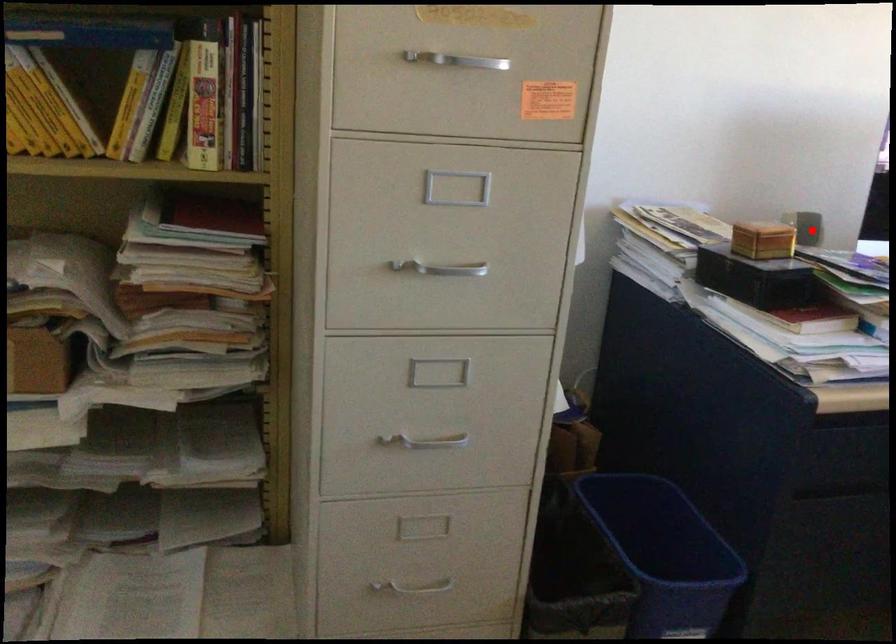
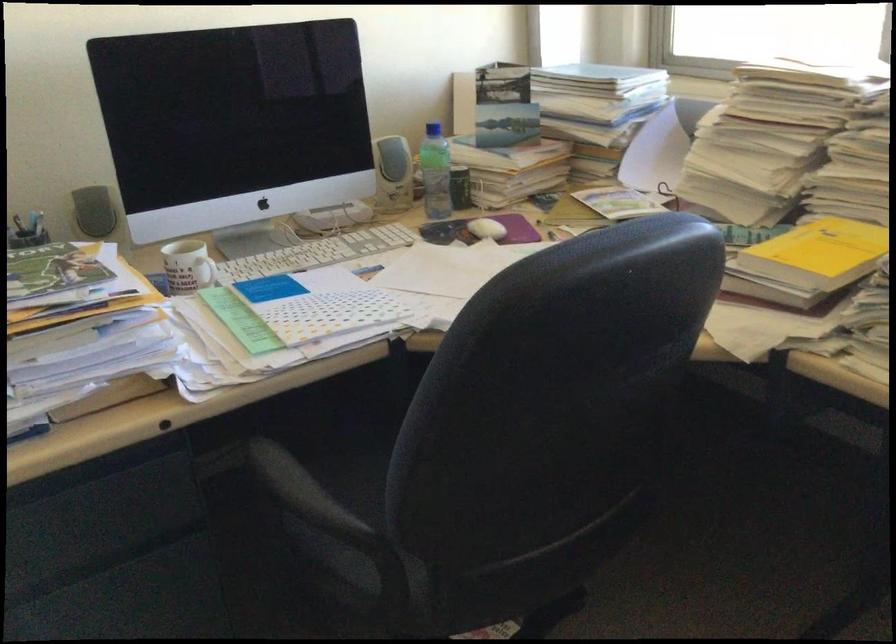
Find the pixel in the second image that matches the highlighted location in the first image.

(93, 211)